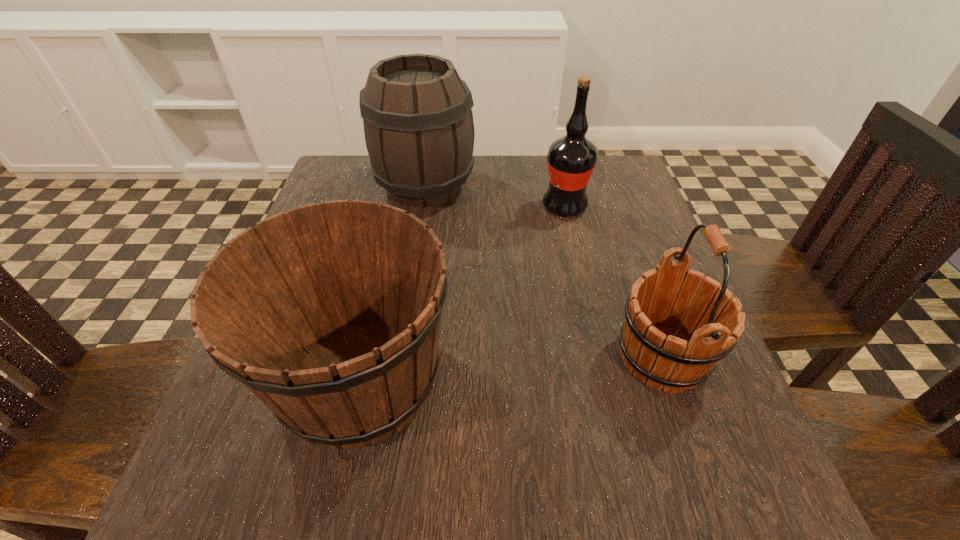
I want to click on vacant area that lies between the rightmost wine bucket and the wine bottle, so click(x=612, y=282).

Locate an element on the screen. The height and width of the screenshot is (540, 960). free spot between the wine bottle and the rightmost wine bucket is located at coordinates coord(612,282).

Image resolution: width=960 pixels, height=540 pixels. Identify the location of vacant space that's between the wine bottle and the farthest wine bucket. (494, 197).

What are the coordinates of `free space between the rightmost wine bucket and the farthest wine bucket` in the screenshot? It's located at (543, 272).

Find the location of `object that stands as the second closest to the farthest wine bucket`. object that stands as the second closest to the farthest wine bucket is located at coordinates (330, 314).

Identify which object is the second nearest to the rightmost wine bucket. Please provide its 2D coordinates. Your answer should be formatted as a tuple, i.e. [(x, y)], where the tuple contains the x and y coordinates of a point satisfying the conditions above.

[(571, 159)]

The height and width of the screenshot is (540, 960). Identify the location of wine bucket that is the closest to the farthest wine bucket. (330, 314).

I want to click on the closest wine bucket to the farthest wine bucket, so click(330, 314).

Find the location of `vacant space that satisfies the following two spatial constraints: 1. on the front side of the farthest wine bucket; 2. on the left side of the rightmost wine bucket`. vacant space that satisfies the following two spatial constraints: 1. on the front side of the farthest wine bucket; 2. on the left side of the rightmost wine bucket is located at coordinates (398, 357).